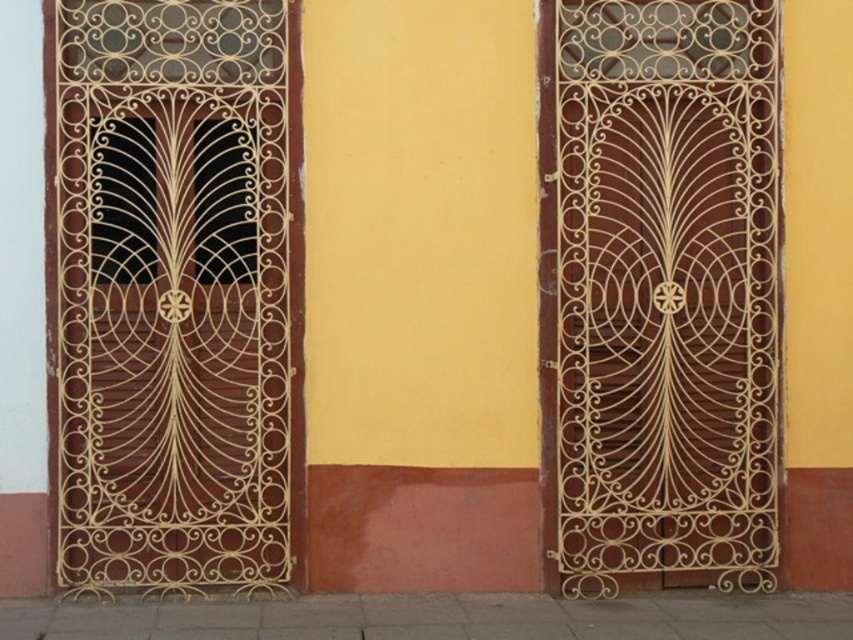
Question: Does gold wrought iron door at left have a smaller size compared to brown wood door at center?

Choices:
 (A) yes
 (B) no

Answer: (A)

Question: Among these objects, which one is nearest to the camera?

Choices:
 (A) brown wood door at center
 (B) gold wrought iron door at left

Answer: (B)

Question: Which point is closer to the camera?

Choices:
 (A) (250, 179)
 (B) (560, 392)

Answer: (A)

Question: Is gold wrought iron door at left behind brown wood door at center?

Choices:
 (A) no
 (B) yes

Answer: (A)

Question: Where is gold wrought iron door at left located in relation to brown wood door at center in the image?

Choices:
 (A) right
 (B) left

Answer: (B)

Question: Which point is farther to the camera?

Choices:
 (A) gold wrought iron door at left
 (B) brown wood door at center

Answer: (B)